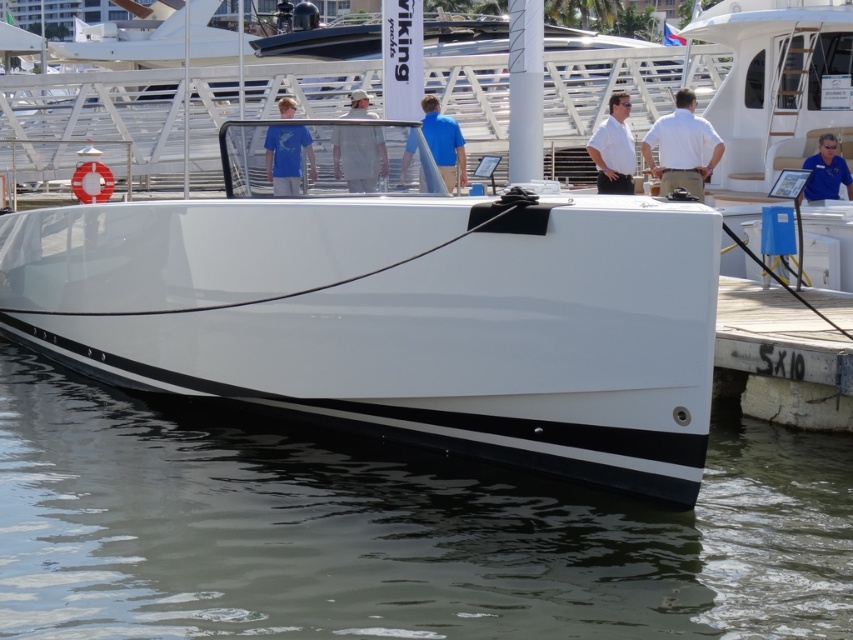
Which of these two, white glossy boat at center or matte blue shirt at center, stands shorter?

Standing shorter between the two is matte blue shirt at center.

Which is more to the right, white glossy boat at center or matte blue shirt at center?

matte blue shirt at center

This screenshot has height=640, width=853. What do you see at coordinates (395, 307) in the screenshot?
I see `white glossy boat at center` at bounding box center [395, 307].

Find the location of `white glossy boat at center`. white glossy boat at center is located at coordinates (395, 307).

Does wooden dock at lower right appear under matte blue shirt at upper center?

Yes, wooden dock at lower right is below matte blue shirt at upper center.

Which is more to the right, wooden dock at lower right or matte blue shirt at upper center?

From the viewer's perspective, wooden dock at lower right appears more on the right side.

Which is in front, point (782, 396) or point (276, 131)?

Point (276, 131) is more forward.

At what (x,y) coordinates should I click in order to perform the action: click on wooden dock at lower right. Please return your answer as a coordinate pair (x, y). This screenshot has height=640, width=853. Looking at the image, I should click on (780, 358).

Is glossy white water at lower center further to camera compared to white matte shirt at center?

→ That is False.

I want to click on glossy white water at lower center, so click(x=390, y=532).